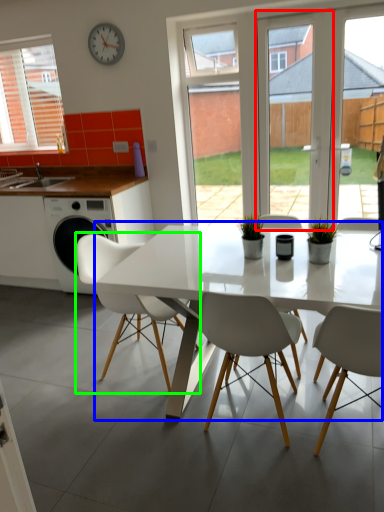
Question: Which object is positioned closest to screen door (highlighted by a red box)? Select from kitchen & dining room table (highlighted by a blue box) and chair (highlighted by a green box).

Choices:
 (A) kitchen & dining room table
 (B) chair

Answer: (A)